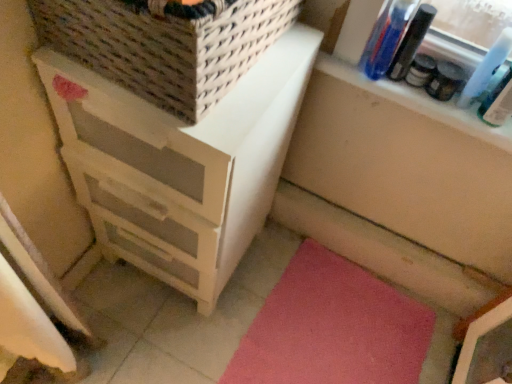
Where is `vacant area on top of clear plastic bottles at upper right (from a real-world perspective)`? The image size is (512, 384). vacant area on top of clear plastic bottles at upper right (from a real-world perspective) is located at coordinates (403, 81).